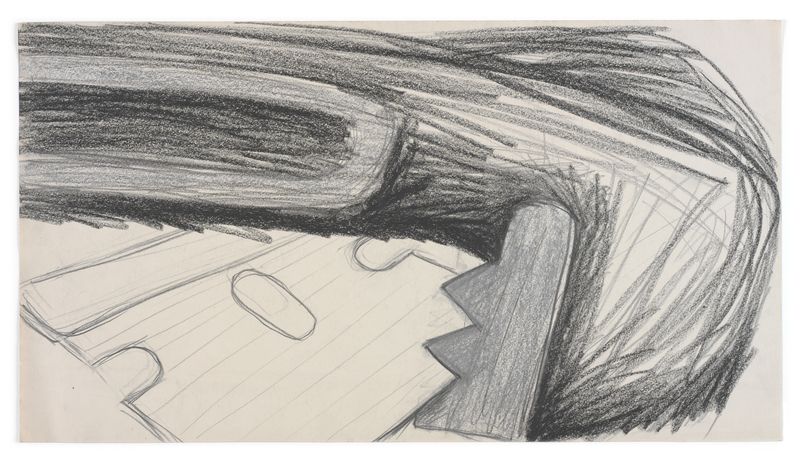
Identify the location of corner. The height and width of the screenshot is (464, 800). (766, 61).